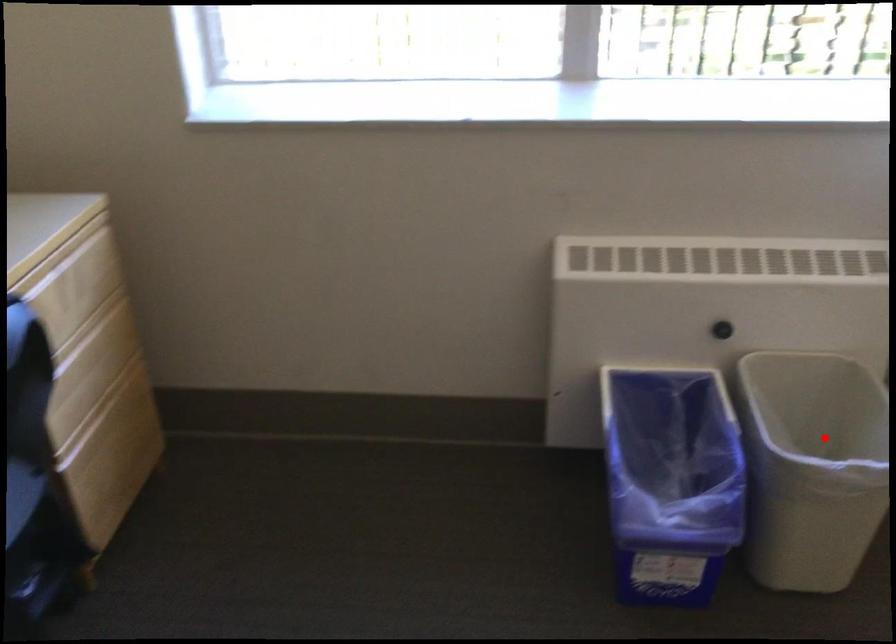
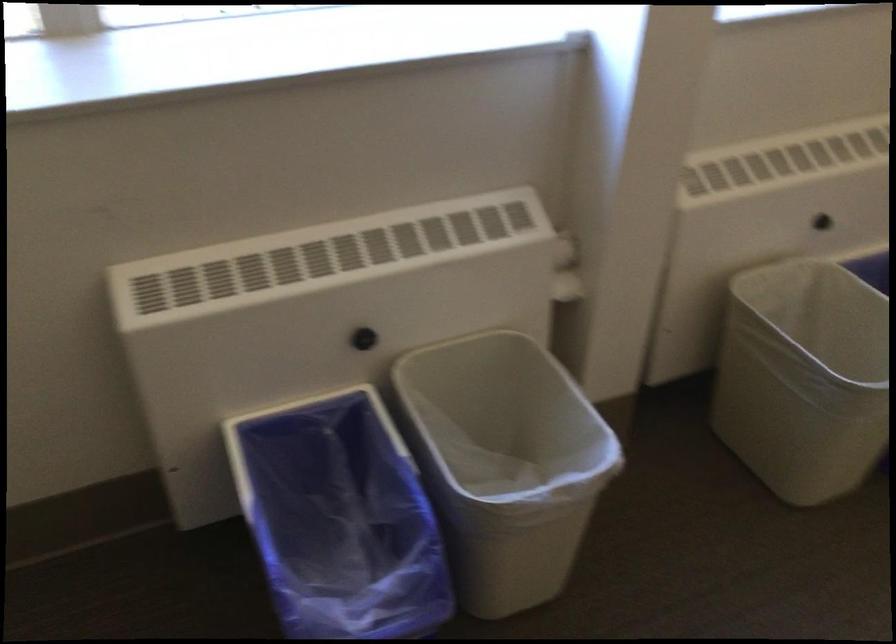
Locate, in the second image, the point that corresponds to the highlighted location in the first image.

(506, 424)